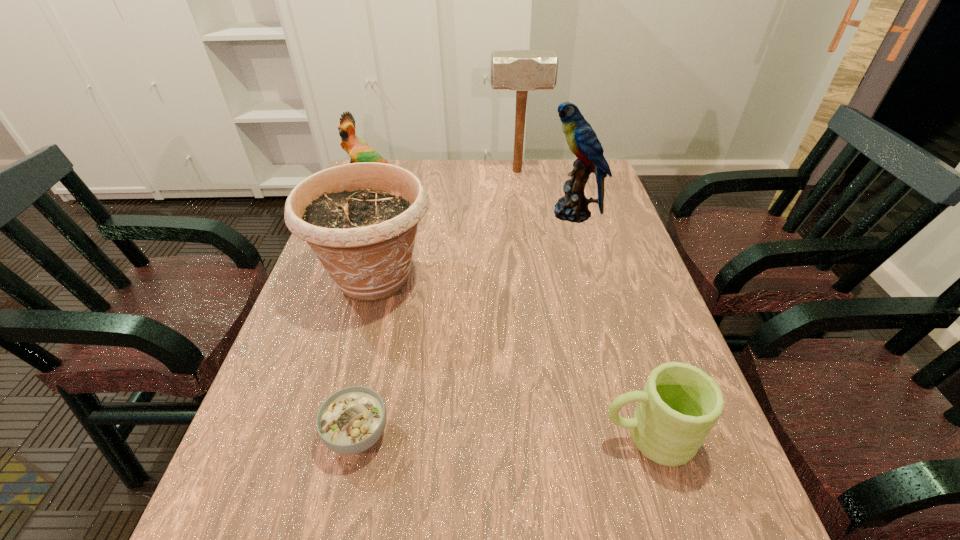
What are the coordinates of `the farthest object` in the screenshot? It's located at (521, 70).

I want to click on the right parrot, so click(582, 140).

Image resolution: width=960 pixels, height=540 pixels. Find the location of `the taller parrot`. the taller parrot is located at coordinates (582, 140).

Locate an element on the screen. The height and width of the screenshot is (540, 960). the left parrot is located at coordinates (359, 151).

Where is `the third nearest object`? This screenshot has height=540, width=960. the third nearest object is located at coordinates (360, 219).

At what (x,y) coordinates should I click in order to perform the action: click on mug. Please return your answer as a coordinate pair (x, y). Looking at the image, I should click on (680, 403).

Identify the location of soup bowl. (350, 421).

The width and height of the screenshot is (960, 540). Identify the location of free region located 0.180m on the striking face of the farthest object. (438, 171).

Find the location of `free region located on the striking face of the farthest object`. free region located on the striking face of the farthest object is located at coordinates (464, 171).

In order to click on vacant space located on the striking face of the farthest object in this screenshot , I will do `click(381, 171)`.